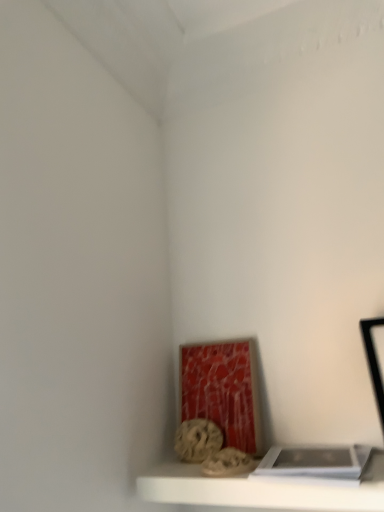
Where is `white matte book at lower right`? Image resolution: width=384 pixels, height=512 pixels. white matte book at lower right is located at coordinates (316, 464).

This screenshot has height=512, width=384. Find the location of `white matte shelf at lower center`. white matte shelf at lower center is located at coordinates (263, 489).

I want to click on rustic stone sculpture at lower center, so 197,440.

Is white matte book at lower right positioned with its back to rustic stone sculpture at lower center?

white matte book at lower right does not have its back to rustic stone sculpture at lower center.

Do you think white matte book at lower right is within rustic stone sculpture at lower center, or outside of it?

white matte book at lower right is outside rustic stone sculpture at lower center.

Considering the relative sizes of white matte book at lower right and rustic stone sculpture at lower center in the image provided, is white matte book at lower right bigger than rustic stone sculpture at lower center?

Correct, white matte book at lower right is larger in size than rustic stone sculpture at lower center.

Where is `art that appears on the left of white matte book at lower right`? art that appears on the left of white matte book at lower right is located at coordinates (197, 440).

Where is `shelf on the left side of white matte book at lower right`? The width and height of the screenshot is (384, 512). shelf on the left side of white matte book at lower right is located at coordinates (263, 489).

Is there a large distance between white matte book at lower right and white matte shelf at lower center?

That's not correct — white matte book at lower right is a little close to white matte shelf at lower center.

How many degrees apart are the facing directions of white matte book at lower right and white matte shelf at lower center?

white matte book at lower right and white matte shelf at lower center are facing 0.235 degrees away from each other.

Relative to white matte book at lower right, is rustic stone sculpture at lower center in front or behind?

Visually, rustic stone sculpture at lower center is located behind white matte book at lower right.

Which of these two, rustic stone sculpture at lower center or white matte book at lower right, is bigger?

With larger size is white matte book at lower right.

From the image's perspective, who appears lower, rustic stone sculpture at lower center or white matte book at lower right?

rustic stone sculpture at lower center appears lower in the image.

Is rustic stone sculpture at lower center wider or thinner than white matte book at lower right?

Considering their sizes, rustic stone sculpture at lower center looks slimmer than white matte book at lower right.

Does rustic stone sculpture at lower center have a lesser height compared to white matte shelf at lower center?

Incorrect, the height of rustic stone sculpture at lower center does not fall short of that of white matte shelf at lower center.

How different are the orientations of rustic stone sculpture at lower center and white matte shelf at lower center in degrees?

There is a 5.49-degree angle between the facing directions of rustic stone sculpture at lower center and white matte shelf at lower center.

Considering the points (179, 450) and (310, 497), which point is behind, point (179, 450) or point (310, 497)?

The point (179, 450) is behind.

Is rustic stone sculpture at lower center wider than white matte shelf at lower center?

In fact, rustic stone sculpture at lower center might be narrower than white matte shelf at lower center.

Which is more to the right, white matte shelf at lower center or rustic stone sculpture at lower center?

white matte shelf at lower center.

Based on the photo, which is in front, white matte shelf at lower center or rustic stone sculpture at lower center?

Positioned in front is white matte shelf at lower center.

How different are the orientations of white matte shelf at lower center and rustic stone sculpture at lower center in degrees?

The angle between the facing direction of white matte shelf at lower center and the facing direction of rustic stone sculpture at lower center is 5.49 degrees.

Considering the sizes of white matte shelf at lower center and white matte book at lower right in the image, is white matte shelf at lower center bigger or smaller than white matte book at lower right?

white matte shelf at lower center is bigger than white matte book at lower right.

Considering the relative positions of white matte shelf at lower center and white matte book at lower right in the image provided, is white matte shelf at lower center to the left or to the right of white matte book at lower right?

white matte shelf at lower center is to the left of white matte book at lower right.

Between white matte shelf at lower center and white matte book at lower right, which one has smaller width?

white matte book at lower right.

The width and height of the screenshot is (384, 512). In order to click on book that appears above the rustic stone sculpture at lower center (from the image's perspective) in this screenshot , I will do `click(316, 464)`.

Find the location of a particular element. This screenshot has width=384, height=512. book on the right of white matte shelf at lower center is located at coordinates (316, 464).

Considering their positions, is rustic stone sculpture at lower center positioned further to white matte book at lower right than white matte shelf at lower center?

rustic stone sculpture at lower center.

Based on their spatial positions, is white matte book at lower right or white matte shelf at lower center further from rustic stone sculpture at lower center?

white matte book at lower right.

When comparing their distances from rustic stone sculpture at lower center, does white matte shelf at lower center or white matte book at lower right seem closer?

Based on the image, white matte shelf at lower center appears to be nearer to rustic stone sculpture at lower center.

Considering their positions, is white matte shelf at lower center positioned further to white matte book at lower right than rustic stone sculpture at lower center?

rustic stone sculpture at lower center is positioned further to the anchor white matte book at lower right.

From the image, which object appears to be nearer to white matte shelf at lower center, rustic stone sculpture at lower center or white matte book at lower right?

The object closer to white matte shelf at lower center is white matte book at lower right.

Which object lies nearer to the anchor point white matte shelf at lower center, white matte book at lower right or rustic stone sculpture at lower center?

white matte book at lower right is positioned closer to the anchor white matte shelf at lower center.

The width and height of the screenshot is (384, 512). I want to click on shelf between white matte book at lower right and rustic stone sculpture at lower center in the front-back direction, so click(x=263, y=489).